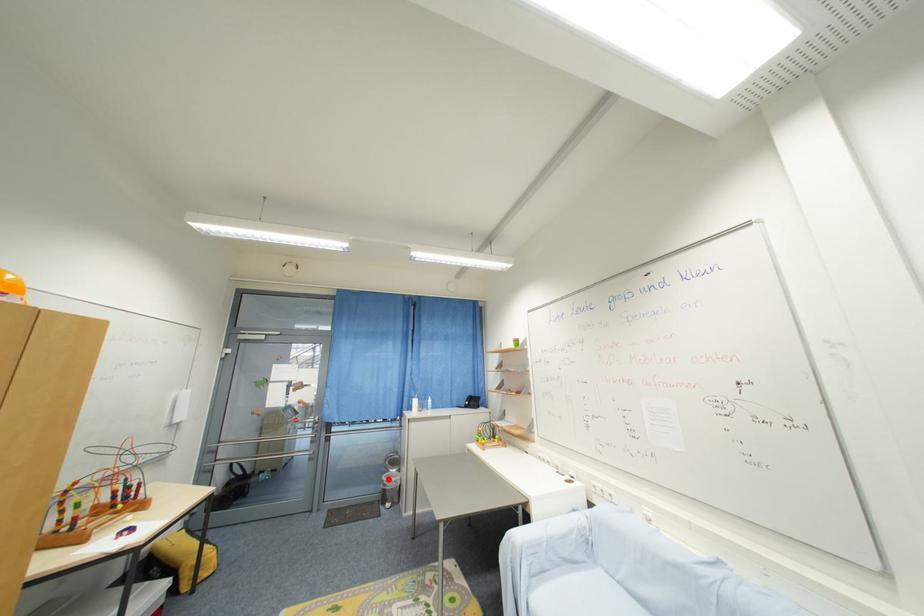
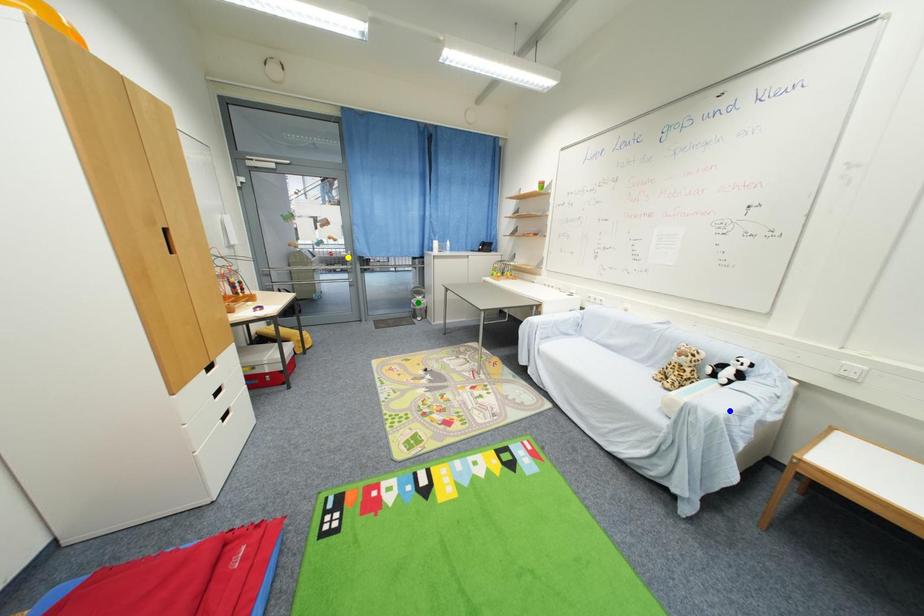
Question: I am providing you with two images of the same scene from different viewpoints. A red point is marked on the first image. You are given multiple points on the second image. Which point in image 2 represents the same 3d spot as the red point in image 1?

Choices:
 (A) blue point
 (B) yellow point
 (C) green point

Answer: (C)